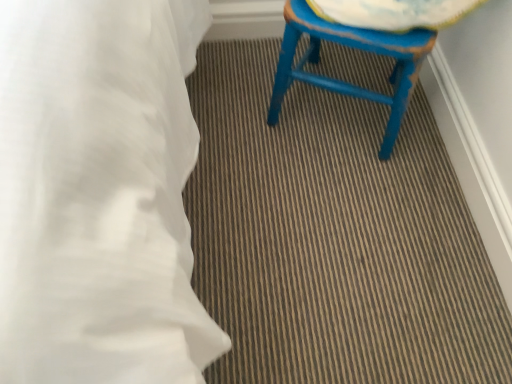
The image size is (512, 384). What do you see at coordinates (351, 47) in the screenshot?
I see `blue painted wood stool at upper right` at bounding box center [351, 47].

The width and height of the screenshot is (512, 384). I want to click on blue painted wood stool at upper right, so click(351, 47).

Based on the photo, measure the distance between point (356, 90) and camera.

The depth of point (356, 90) is 36.18 inches.

The image size is (512, 384). I want to click on blue painted wood stool at upper right, so click(351, 47).